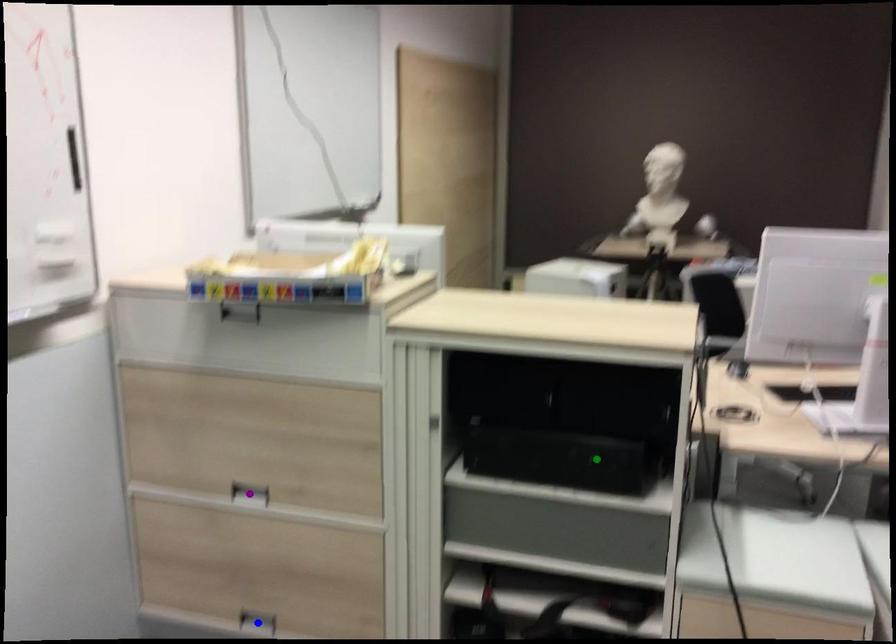
Order these from nearest to farthest:
1. purple point
2. blue point
3. green point

green point → purple point → blue point